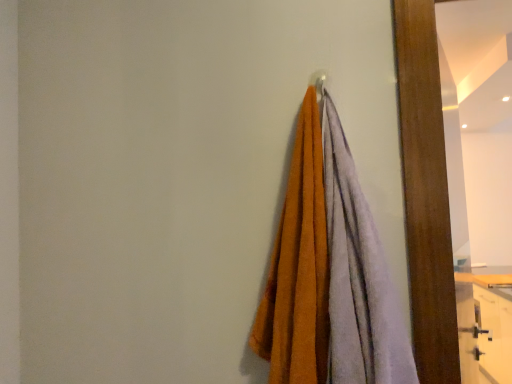
Question: Is wooden dresser at lower right oriented away from wooden mirror at right?

Choices:
 (A) yes
 (B) no

Answer: (B)

Question: Is wooden dresser at lower right wider than wooden mirror at right?

Choices:
 (A) yes
 (B) no

Answer: (A)

Question: Does wooden dresser at lower right have a smaller size compared to wooden mirror at right?

Choices:
 (A) no
 (B) yes

Answer: (A)

Question: Is wooden dresser at lower right not inside wooden mirror at right?

Choices:
 (A) no
 (B) yes

Answer: (B)

Question: Is wooden dresser at lower right positioned behind wooden mirror at right?

Choices:
 (A) yes
 (B) no

Answer: (A)

Question: Is wooden dresser at lower right taller or shorter than soft cotton towels at center?

Choices:
 (A) short
 (B) tall

Answer: (B)

Question: In the image, is wooden dresser at lower right positioned in front of or behind soft cotton towels at center?

Choices:
 (A) front
 (B) behind

Answer: (B)

Question: In terms of width, does wooden dresser at lower right look wider or thinner when compared to soft cotton towels at center?

Choices:
 (A) wide
 (B) thin

Answer: (A)

Question: Considering the positions of point pos(499,355) and point pos(349,246), is point pos(499,355) closer or farther from the camera than point pos(349,246)?

Choices:
 (A) farther
 (B) closer

Answer: (A)

Question: In the image, is soft cotton towels at center on the left side or the right side of wooden dresser at lower right?

Choices:
 (A) left
 (B) right

Answer: (A)

Question: Considering the positions of soft cotton towels at center and wooden dresser at lower right in the image, is soft cotton towels at center wider or thinner than wooden dresser at lower right?

Choices:
 (A) thin
 (B) wide

Answer: (A)

Question: Based on their sizes in the image, would you say soft cotton towels at center is bigger or smaller than wooden dresser at lower right?

Choices:
 (A) small
 (B) big

Answer: (A)

Question: In the image, is soft cotton towels at center positioned in front of or behind wooden dresser at lower right?

Choices:
 (A) front
 (B) behind

Answer: (A)

Question: Based on their sizes in the image, would you say wooden mirror at right is bigger or smaller than wooden dresser at lower right?

Choices:
 (A) big
 (B) small

Answer: (B)

Question: From a real-world perspective, is wooden mirror at right physically located above or below wooden dresser at lower right?

Choices:
 (A) above
 (B) below

Answer: (A)